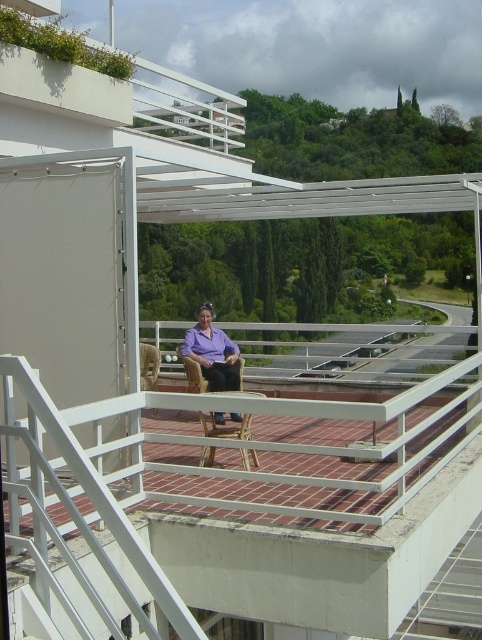
You are a guest at this balcony and want to sit comfortably. The purple fabric chair at center and the brown woven chair at center are available. Which chair is taller?

The purple fabric chair at center is taller than the brown woven chair at center.

You are standing on the balcony and want to place a potted plant exactly at the point marked by the coordinates point [212,352]. Is this location suitable for placing the plant, considering the existing furniture?

The point [212,352] corresponds to the purple fabric chair at center, so placing the potted plant there would not be suitable as it is already occupied by the chair.

You are planning to host a small gathering on your balcony and want to seat two people comfortably. Given the space available, will the purple fabric chair at center and the brown woven chair at center fit side by side without overlapping?

The purple fabric chair at center is wider than the brown woven chair at center. To determine if they can fit side by side, you need to know the total width of both chairs combined and compare it to the available space on the balcony. Since the balcony has red brick tiles arranged in a grid pattern and the chairs are at the center, there might be enough space, but this depends on the exact dimensions of the chairs and the balcony area.